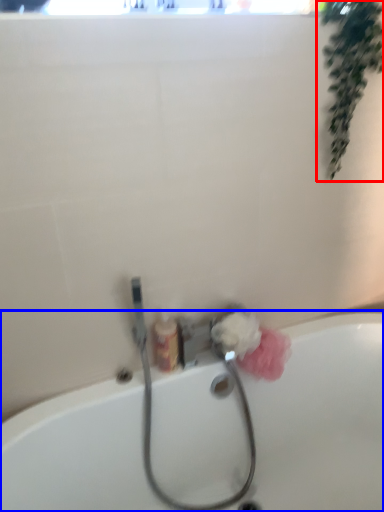
Question: Which point is further to the camera, plant (highlighted by a red box) or bathtub (highlighted by a blue box)?

Choices:
 (A) plant
 (B) bathtub

Answer: (A)